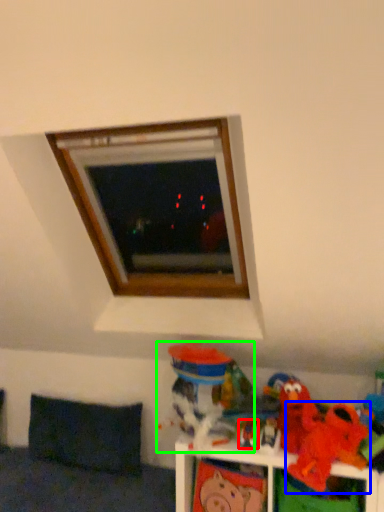
Question: Which is farther away from toy (highlighted by a red box)? toy (highlighted by a blue box) or toy (highlighted by a green box)?

Choices:
 (A) toy
 (B) toy

Answer: (A)